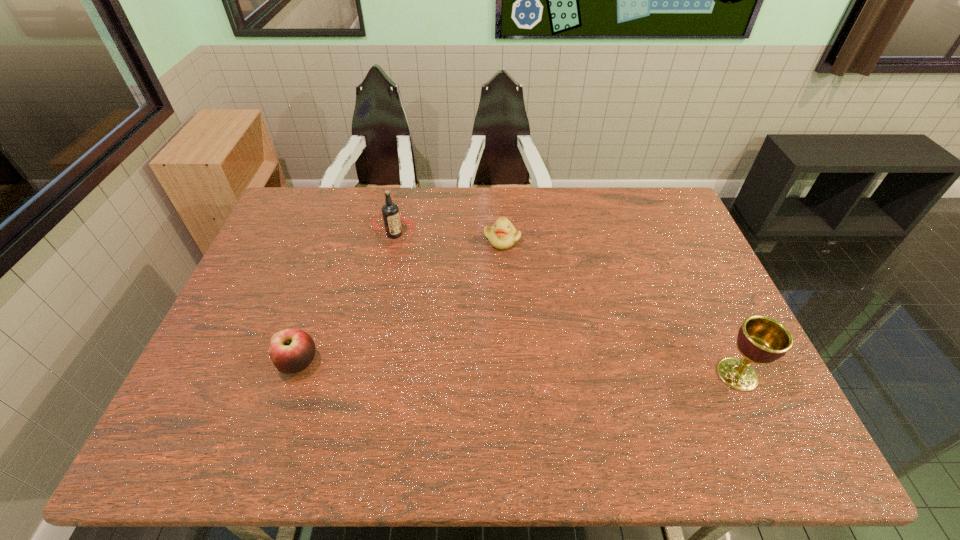
Image resolution: width=960 pixels, height=540 pixels. In order to click on free space located 0.330m on the beak of the shortest object in this screenshot , I will do `click(546, 333)`.

The width and height of the screenshot is (960, 540). I want to click on free space located on the label of the root beer, so click(403, 260).

The image size is (960, 540). I want to click on free spot located on the label of the root beer, so click(422, 302).

You are a GUI agent. You are given a task and a screenshot of the screen. Output one action in this format:
    pyautogui.click(x=<x>, y=<y>)
    Task: Click on the free space located on the label of the root beer
    
    Given the screenshot: What is the action you would take?
    pyautogui.click(x=415, y=286)

Where is `duckling located in the far edge section of the desktop`? This screenshot has width=960, height=540. duckling located in the far edge section of the desktop is located at coordinates (502, 235).

Find the location of a particular element. root beer present at the far edge is located at coordinates (392, 219).

Find the location of a particular element. apple that is at the near edge is located at coordinates (292, 350).

Find the location of a particular element. chalice that is at the near edge is located at coordinates (761, 339).

Where is `object at the right edge`? object at the right edge is located at coordinates (761, 339).

Find the location of a particular element. The width and height of the screenshot is (960, 540). object that is at the near right corner is located at coordinates (761, 339).